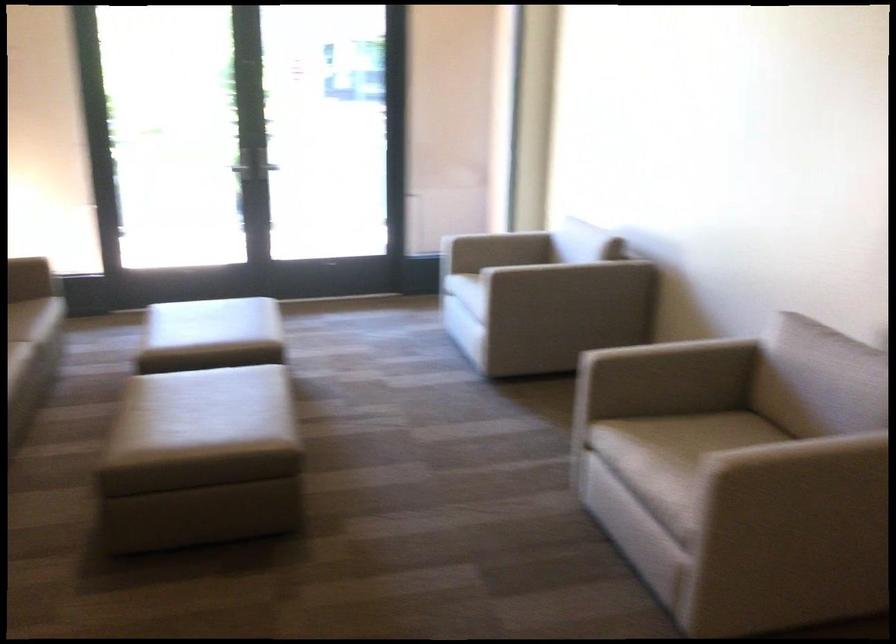
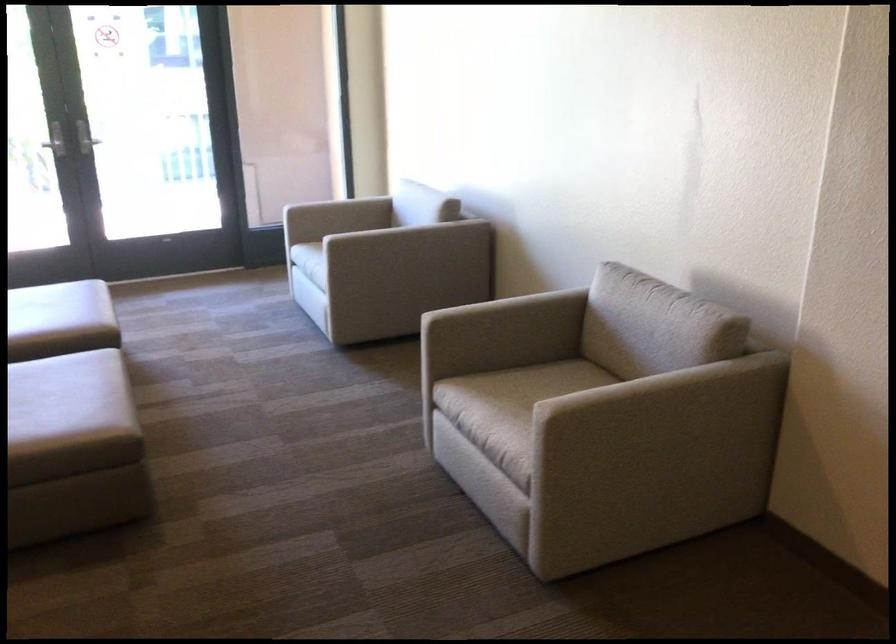
The point at (574, 281) is marked in the first image. Where is the corresponding point in the second image?

(417, 242)